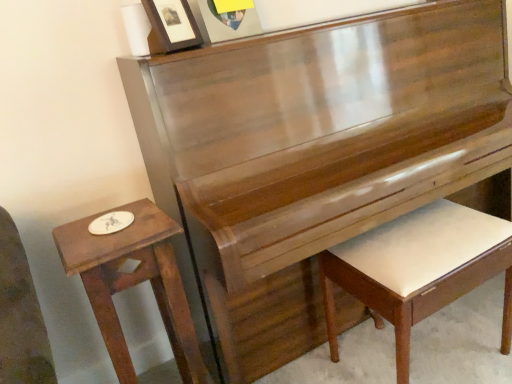
Question: Looking at their shapes, would you say wooden table at left is wider or thinner than matte wooden picture frame at upper center, the second picture frame viewed from the left?

Choices:
 (A) wide
 (B) thin

Answer: (A)

Question: Does point (154, 236) appear closer or farther from the camera than point (199, 8)?

Choices:
 (A) farther
 (B) closer

Answer: (B)

Question: Which object is positioned farthest from the matte black picture frame at upper center, placed as the second picture frame when sorted from right to left?

Choices:
 (A) wooden table at left
 (B) white leather piano bench at lower right
 (C) matte wooden picture frame at upper center, placed as the first picture frame when sorted from right to left

Answer: (B)

Question: Considering the real-world distances, which object is farthest from the matte black picture frame at upper center, placed as the second picture frame when sorted from right to left?

Choices:
 (A) white leather piano bench at lower right
 (B) wooden table at left
 (C) matte wooden picture frame at upper center, the second picture frame viewed from the left

Answer: (A)